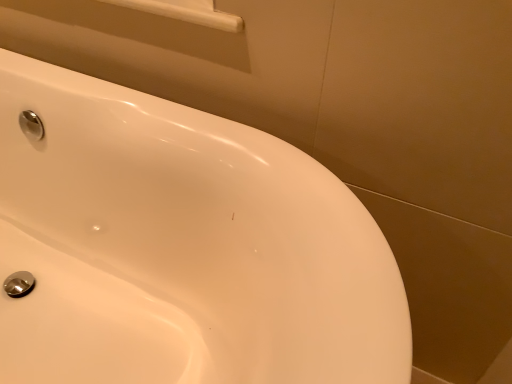
Where is `white glossy bathtub at upper left`? The image size is (512, 384). white glossy bathtub at upper left is located at coordinates (181, 247).

What do you see at coordinates (181, 247) in the screenshot?
I see `white glossy bathtub at upper left` at bounding box center [181, 247].

Where is `white glossy bathtub at upper left`? The height and width of the screenshot is (384, 512). white glossy bathtub at upper left is located at coordinates coord(181,247).